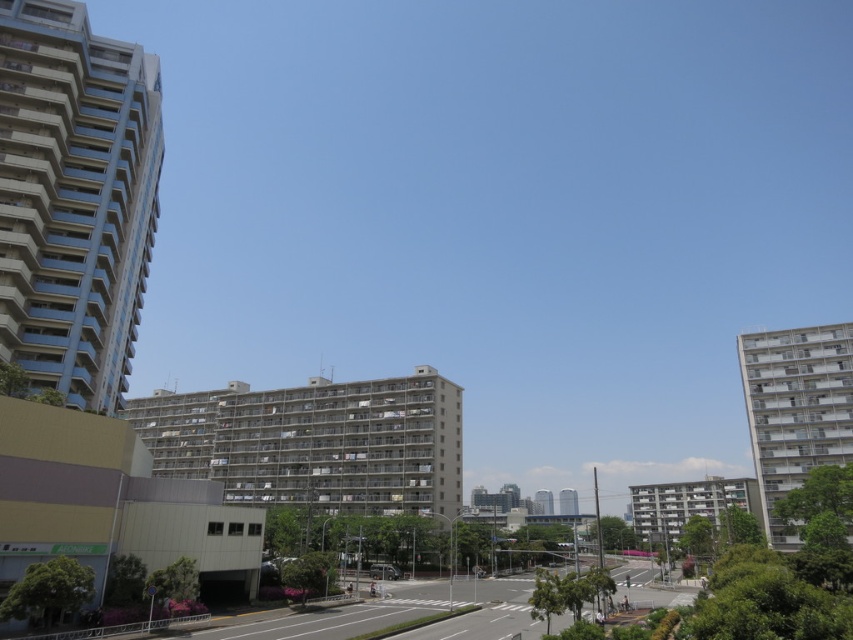
Question: Does white glossy building at right appear on the right side of metallic silver van at center?

Choices:
 (A) no
 (B) yes

Answer: (B)

Question: Which point is closer to the camera?

Choices:
 (A) (28, 314)
 (B) (576, 513)

Answer: (A)

Question: Estimate the real-world distances between objects in this image. Which object is closer to the white concrete building at center?

Choices:
 (A) smooth concrete tower at center
 (B) white glossy building at right
 (C) metallic silver van at center
 (D) light blue concrete building at left

Answer: (A)

Question: Does white concrete building at center have a larger size compared to metallic silver van at center?

Choices:
 (A) no
 (B) yes

Answer: (B)

Question: Among these objects, which one is nearest to the camera?

Choices:
 (A) smooth concrete tower at center
 (B) light blue concrete building at left

Answer: (B)

Question: Can you confirm if light blue concrete building at left is positioned below white glossy building at right?

Choices:
 (A) no
 (B) yes

Answer: (A)